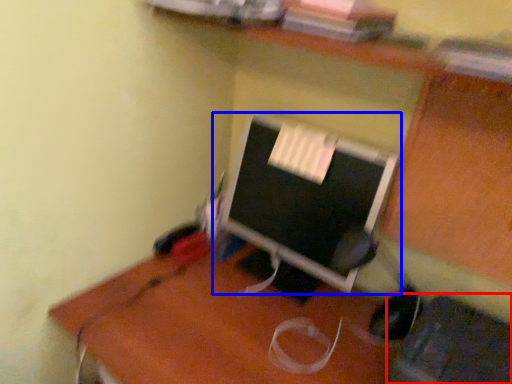
Question: Which object is closer to the camera taking this photo, computer chair (highlighted by a red box) or computer monitor (highlighted by a blue box)?

Choices:
 (A) computer chair
 (B) computer monitor

Answer: (A)